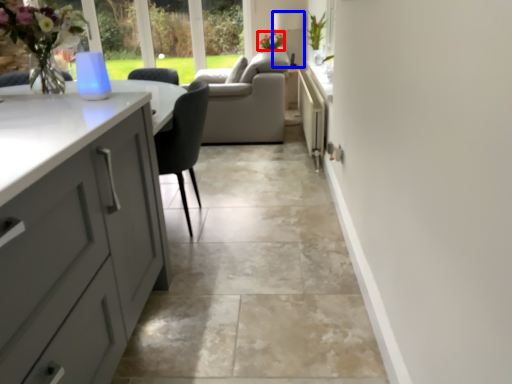
Question: Which point is further to the camera, flower (highlighted by a red box) or lamp (highlighted by a blue box)?

Choices:
 (A) flower
 (B) lamp

Answer: (B)